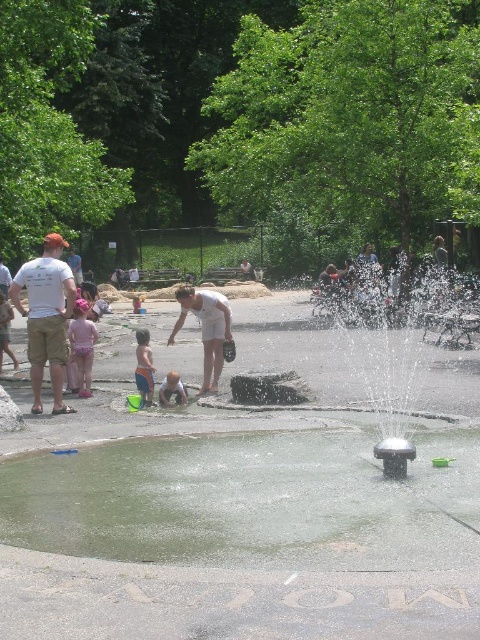
Between point (324, 404) and point (87, 392), which one is positioned in front?

Positioned in front is point (324, 404).

Can you confirm if metallic gray fountain at center is bigger than pink fabric dress at left?

Indeed, metallic gray fountain at center has a larger size compared to pink fabric dress at left.

Identify the location of metallic gray fountain at center. This screenshot has width=480, height=640. (256, 456).

Where is `metallic gray fountain at center`? metallic gray fountain at center is located at coordinates (256, 456).

Who is taller, clear water at center or white t-shirt at left?

white t-shirt at left

Can you confirm if clear water at center is wider than white t-shirt at left?

Correct, the width of clear water at center exceeds that of white t-shirt at left.

The height and width of the screenshot is (640, 480). What are the coordinates of `clear water at center` in the screenshot? It's located at (250, 500).

Identify the location of clear water at center. (250, 500).

Is pink fabric dress at left below light blue fabric pants at center?

No.

Can you confirm if pink fabric dress at left is thinner than light blue fabric pants at center?

No, pink fabric dress at left is not thinner than light blue fabric pants at center.

Which is behind, point (81, 353) or point (175, 385)?

Positioned behind is point (81, 353).

Find the location of a particular element. pink fabric dress at left is located at coordinates click(x=82, y=346).